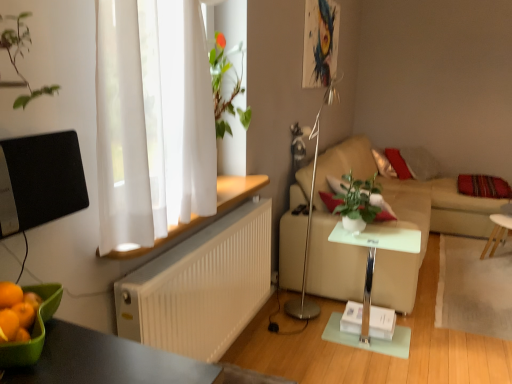
You are a GUI agent. You are given a task and a screenshot of the screen. Output one action in this format:
    pyautogui.click(x=<x>, y=<y>)
    Task: Click on the vacant area on top of white glossy side table at center, marked as the 1th table in a front-to-back arrangement (from a real-world perspective)
    The width and height of the screenshot is (512, 384).
    Given the screenshot: What is the action you would take?
    pyautogui.click(x=380, y=233)